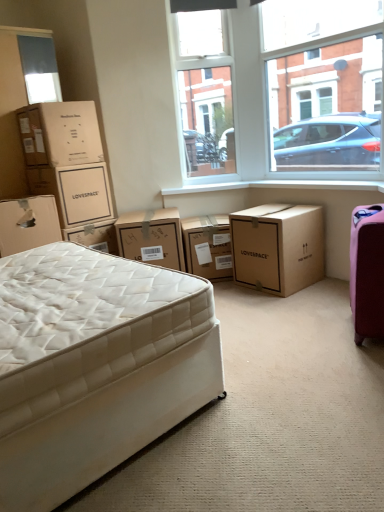
Find the location of a particular element. The image size is (384, 512). free space in front of brown cardboard box at center, arranged as the first box when viewed from the right is located at coordinates (292, 301).